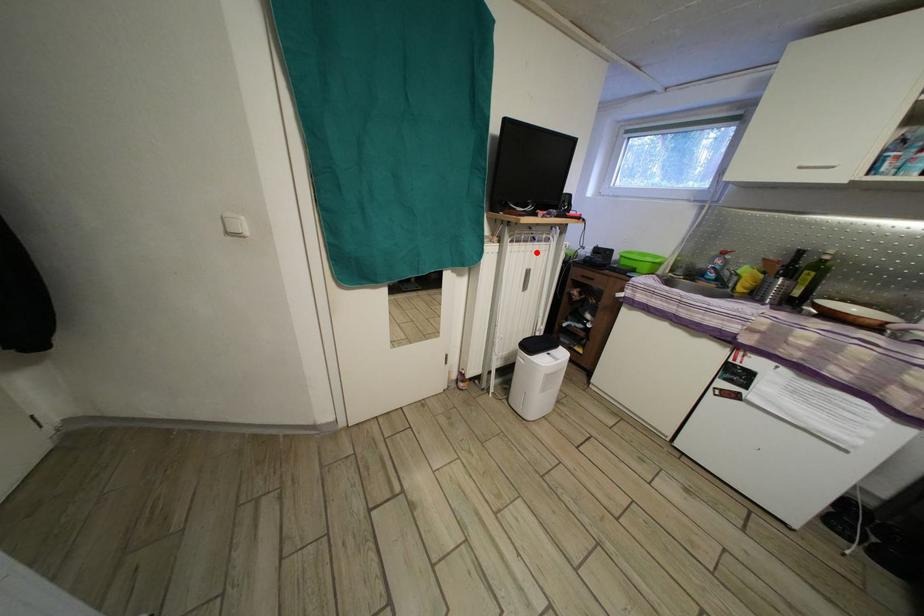
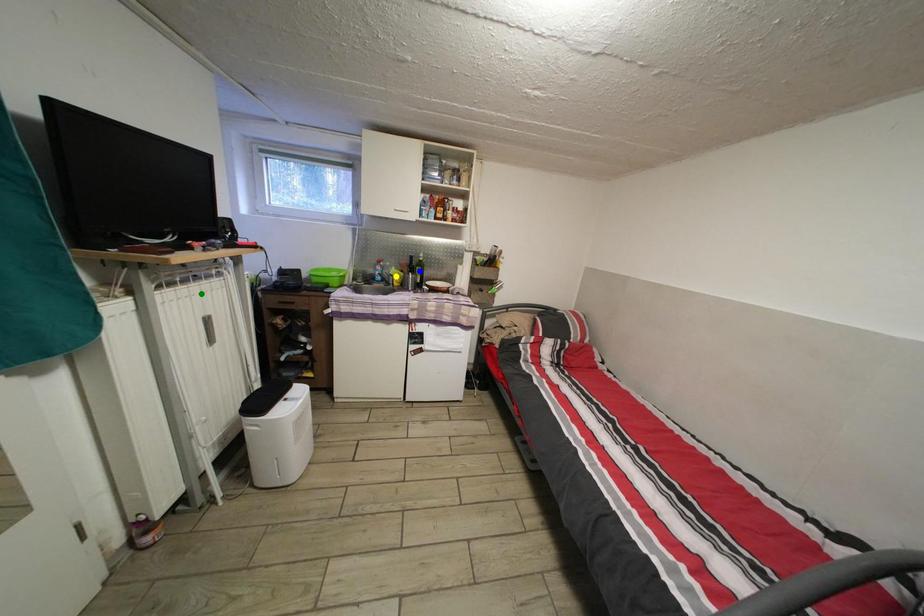
Question: I am providing you with two images of the same scene from different viewpoints. A red point is marked on the first image. You are given multiple points on the second image. Which point in image 2 is actually the same real-world point as the red point in image 1?

Choices:
 (A) blue point
 (B) green point
 (C) yellow point

Answer: (B)